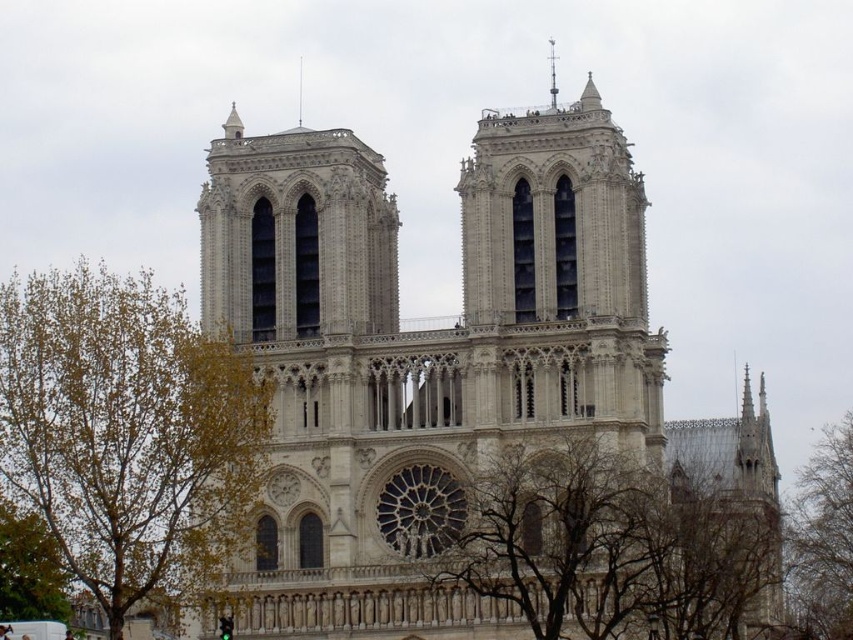
Which is more to the right, white stone church at center or green leafy tree at lower left?

white stone church at center is more to the right.

Which is below, white stone church at center or green leafy tree at lower left?

green leafy tree at lower left is lower down.

At what (x,y) coordinates should I click in order to perform the action: click on white stone church at center. Please return your answer as a coordinate pair (x, y). This screenshot has width=853, height=640. Looking at the image, I should click on (434, 355).

The width and height of the screenshot is (853, 640). Identify the location of white stone church at center. (434, 355).

Who is lower down, green leafy tree at left or smooth stone spire at upper center?

green leafy tree at left is below.

Does point (160, 506) come in front of point (302, 90)?

Yes, it is.

Where is `green leafy tree at left`? green leafy tree at left is located at coordinates coord(129,433).

Is polished silver spire at upper center below smooth stone spire at upper center?

No, polished silver spire at upper center is not below smooth stone spire at upper center.

Does polished silver spire at upper center appear on the right side of smooth stone spire at upper center?

Yes, polished silver spire at upper center is to the right of smooth stone spire at upper center.

Which is in front, point (549, 81) or point (299, 68)?

Positioned in front is point (549, 81).

This screenshot has width=853, height=640. Find the location of `polished silver spire at upper center`. polished silver spire at upper center is located at coordinates (552, 74).